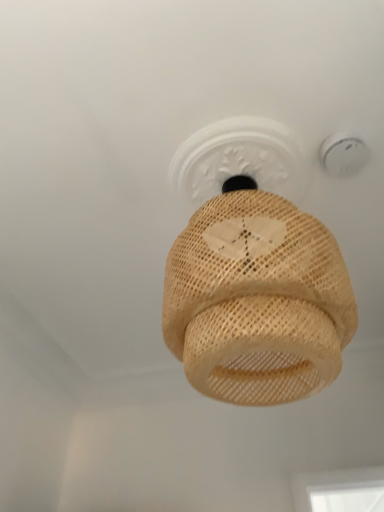
Image resolution: width=384 pixels, height=512 pixels. What do you see at coordinates (343, 154) in the screenshot?
I see `white plastic smoke detector at upper right` at bounding box center [343, 154].

Image resolution: width=384 pixels, height=512 pixels. I want to click on white plastic smoke detector at upper right, so click(343, 154).

Image resolution: width=384 pixels, height=512 pixels. What do you see at coordinates (257, 300) in the screenshot?
I see `natural woven lampshade at center` at bounding box center [257, 300].

The width and height of the screenshot is (384, 512). Identify the location of natural woven lampshade at center. [x=257, y=300].

Locate an element on the screen. white plastic smoke detector at upper right is located at coordinates (343, 154).

Can you confirm if white plastic smoke detector at upper right is positioned to the left of natural woven lampshade at center?

No, white plastic smoke detector at upper right is not to the left of natural woven lampshade at center.

Looking at this image, does white plastic smoke detector at upper right come in front of natural woven lampshade at center?

No, the depth of white plastic smoke detector at upper right is greater than that of natural woven lampshade at center.

Is point (348, 168) more distant than point (188, 376)?

Yes.

From the image's perspective, is white plastic smoke detector at upper right located beneath natural woven lampshade at center?

Actually, white plastic smoke detector at upper right appears above natural woven lampshade at center in the image.

From a real-world perspective, between white plastic smoke detector at upper right and natural woven lampshade at center, who is vertically lower?

In real-world perspective, natural woven lampshade at center is lower.

Is white plastic smoke detector at upper right thinner than natural woven lampshade at center?

Yes.

Considering the relative sizes of white plastic smoke detector at upper right and natural woven lampshade at center in the image provided, is white plastic smoke detector at upper right taller than natural woven lampshade at center?

In fact, white plastic smoke detector at upper right may be shorter than natural woven lampshade at center.

From the picture: Which of these two, white plastic smoke detector at upper right or natural woven lampshade at center, is bigger?

natural woven lampshade at center is bigger.

Would you say white plastic smoke detector at upper right is inside or outside natural woven lampshade at center?

white plastic smoke detector at upper right lies outside natural woven lampshade at center.

Is white plastic smoke detector at upper right beside natural woven lampshade at center?

There is a gap between white plastic smoke detector at upper right and natural woven lampshade at center.

Is white plastic smoke detector at upper right facing away from natural woven lampshade at center?

No, white plastic smoke detector at upper right's orientation is not away from natural woven lampshade at center.

How distant is white plastic smoke detector at upper right from natural woven lampshade at center?

The distance of white plastic smoke detector at upper right from natural woven lampshade at center is 24.99 inches.

Where is `light fixture above the natural woven lampshade at center (from a real-world perspective)`? light fixture above the natural woven lampshade at center (from a real-world perspective) is located at coordinates (343, 154).

Can you confirm if natural woven lampshade at center is positioned to the left of white plastic smoke detector at upper right?

Yes, natural woven lampshade at center is to the left of white plastic smoke detector at upper right.

Is the depth of natural woven lampshade at center greater than that of white plastic smoke detector at upper right?

No, the depth of natural woven lampshade at center is less than that of white plastic smoke detector at upper right.

Does point (271, 270) lie in front of point (348, 152)?

Yes, point (271, 270) is closer to viewer.

From the image's perspective, between natural woven lampshade at center and white plastic smoke detector at upper right, who is located below?

From the image's view, natural woven lampshade at center is below.

From a real-world perspective, which object stands above the other?

white plastic smoke detector at upper right, from a real-world perspective.

Considering the relative sizes of natural woven lampshade at center and white plastic smoke detector at upper right in the image provided, is natural woven lampshade at center wider than white plastic smoke detector at upper right?

Correct, the width of natural woven lampshade at center exceeds that of white plastic smoke detector at upper right.

Based on the photo, is natural woven lampshade at center shorter than white plastic smoke detector at upper right?

Incorrect, the height of natural woven lampshade at center does not fall short of that of white plastic smoke detector at upper right.

Looking at the image, does natural woven lampshade at center seem bigger or smaller compared to white plastic smoke detector at upper right?

In the image, natural woven lampshade at center appears to be larger than white plastic smoke detector at upper right.

Does natural woven lampshade at center contain white plastic smoke detector at upper right?

Definitely not — white plastic smoke detector at upper right is not inside natural woven lampshade at center.

Are natural woven lampshade at center and white plastic smoke detector at upper right far apart?

No, there isn't a large distance between natural woven lampshade at center and white plastic smoke detector at upper right.

Consider the image. Is natural woven lampshade at center oriented towards white plastic smoke detector at upper right?

No, natural woven lampshade at center is not turned towards white plastic smoke detector at upper right.

How different are the orientations of natural woven lampshade at center and white plastic smoke detector at upper right in degrees?

They differ by 0.000547 degrees in their facing directions.

This screenshot has height=512, width=384. What are the coordinates of `light fixture behind the natural woven lampshade at center` in the screenshot? It's located at (343, 154).

Identify the location of lamp that is under the white plastic smoke detector at upper right (from a real-world perspective). Image resolution: width=384 pixels, height=512 pixels. (257, 300).

Find the location of a particular element. Image resolution: width=384 pixels, height=512 pixels. light fixture that appears behind the natural woven lampshade at center is located at coordinates (343, 154).